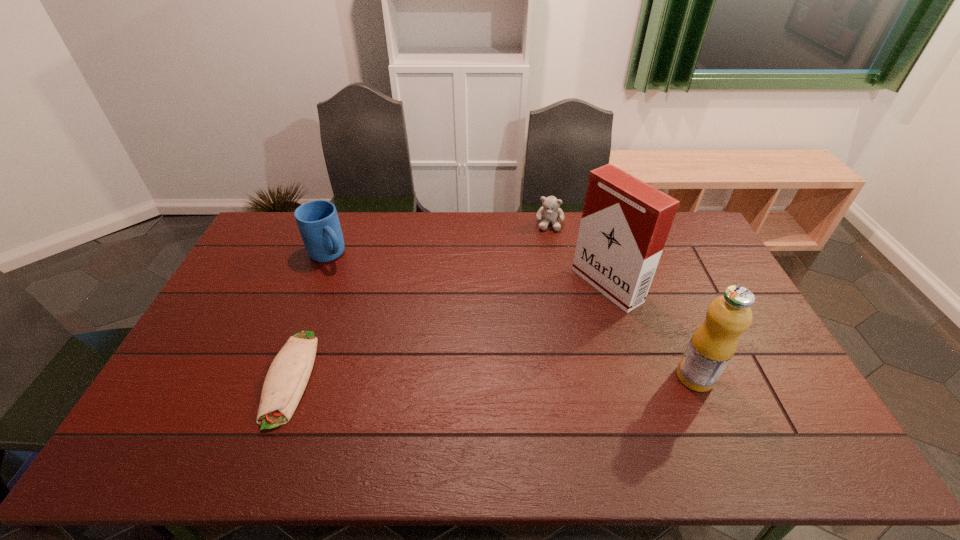
The image size is (960, 540). I want to click on vacant point located 0.260m on the side of the third tallest object with the handle, so click(378, 308).

This screenshot has width=960, height=540. What are the coordinates of `vacant space located 0.190m on the side of the third tallest object with the handle` in the screenshot? It's located at (367, 296).

Where is `vacant space situated on the side of the third tallest object with the handle`? The width and height of the screenshot is (960, 540). vacant space situated on the side of the third tallest object with the handle is located at coordinates [372, 303].

Find the location of a particular element. This screenshot has width=960, height=540. blank space located on the front-facing side of the tallest object is located at coordinates 537,328.

The width and height of the screenshot is (960, 540). What are the coordinates of `vacant space located 0.300m on the front-facing side of the tallest object` in the screenshot? It's located at (x=511, y=343).

You are a GUI agent. You are given a task and a screenshot of the screen. Output one action in this format:
    pyautogui.click(x=<x>, y=<y>)
    Task: Click on the vacant space located on the front-facing side of the tallest object
    This screenshot has width=960, height=540.
    Given the screenshot: What is the action you would take?
    [x=491, y=354]

Identify the location of vacant space located on the face of the fourth tallest object. (548, 241).

At what (x,y) coordinates should I click in order to perform the action: click on vacant space located on the face of the fourth tallest object. Please return your answer as a coordinate pair (x, y). This screenshot has height=540, width=960. Looking at the image, I should click on pyautogui.click(x=542, y=287).

Where is `vacant position located on the face of the fourth tallest object`? This screenshot has height=540, width=960. vacant position located on the face of the fourth tallest object is located at coordinates (542, 292).

The image size is (960, 540). I want to click on mug present at the far edge, so click(318, 222).